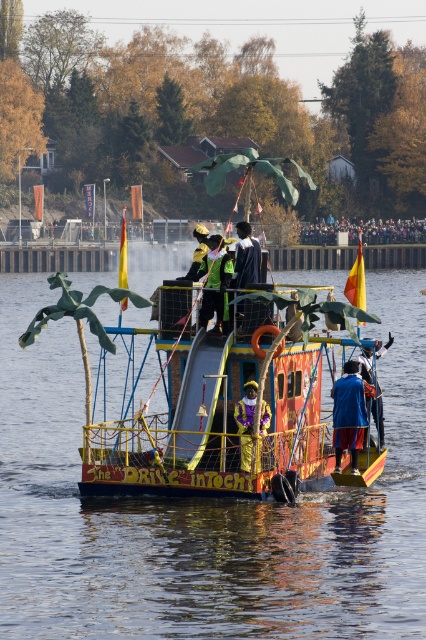
Question: Based on their relative distances, which object is nearer to the blue velvet hat at center?

Choices:
 (A) smooth wooden boat at center
 (B) golden fabric figure at center
 (C) shiny gold helmet at center
 (D) dark blue fabric jacket at center

Answer: (B)

Question: Can you confirm if smooth wooden boat at center is bigger than dark blue fabric jacket at center?

Choices:
 (A) no
 (B) yes

Answer: (B)

Question: Which object is farther from the camera taking this photo?

Choices:
 (A) golden fabric figure at center
 (B) blue velvet hat at center
 (C) blue fabric at center
 (D) wooden painted boat at center

Answer: (B)

Question: Is blue fabric at center closer to the viewer compared to dark blue fabric jacket at center?

Choices:
 (A) no
 (B) yes

Answer: (A)

Question: Among these points, which one is farthest from the camera?

Choices:
 (A) (241, 440)
 (B) (219, 316)
 (C) (195, 273)
 (D) (348, 417)

Answer: (C)

Question: Can you confirm if wooden painted boat at center is wider than golden fabric figure at center?

Choices:
 (A) no
 (B) yes

Answer: (B)